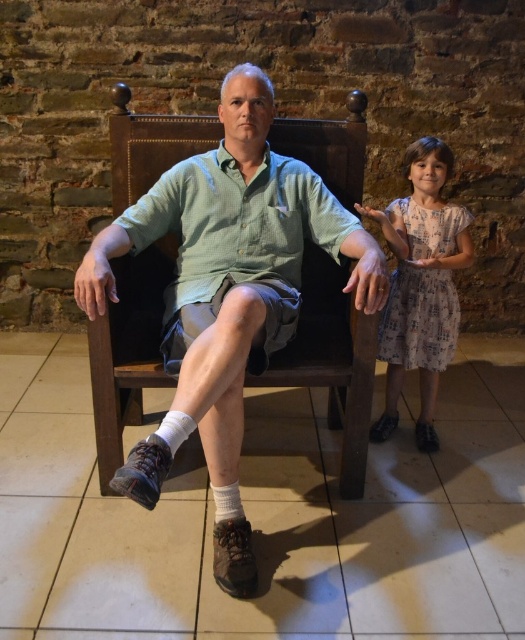
Measure the distance between green checkered shirt at center and camera.

green checkered shirt at center is 1.33 meters from camera.

Locate an element on the screen. green checkered shirt at center is located at coordinates (226, 294).